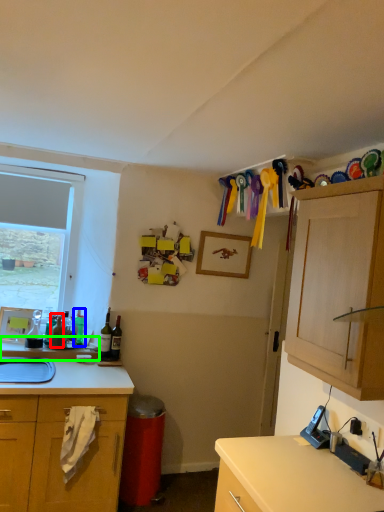
Question: Which object is the farthest from bottle (highlighted by a red box)? Choose among these: bottle (highlighted by a blue box) or countertop (highlighted by a green box).

Choices:
 (A) bottle
 (B) countertop

Answer: (B)